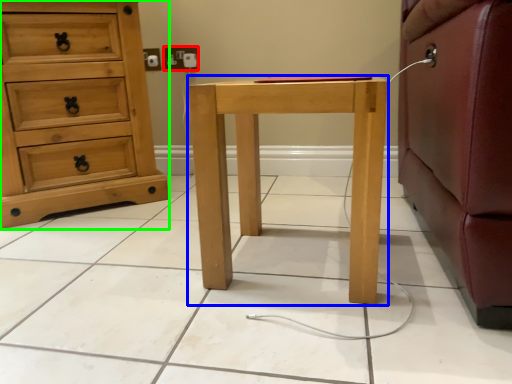
Question: Which object is the farthest from electric outlet (highlighted by a red box)? Choose among these: nightstand (highlighted by a blue box) or chest of drawers (highlighted by a green box).

Choices:
 (A) nightstand
 (B) chest of drawers

Answer: (A)